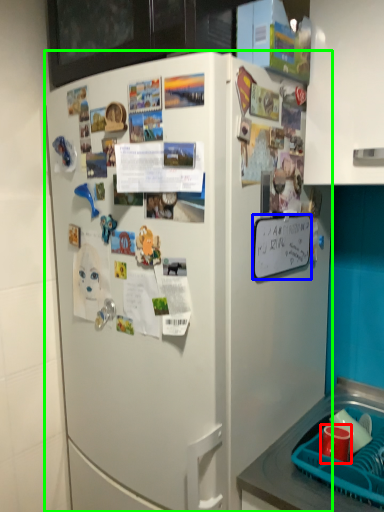
Question: Based on their relative distances, which object is farther from coffee cup (highlighted by a red box)? Choose from poster (highlighted by a blue box) and refrigerator (highlighted by a green box).

Choices:
 (A) poster
 (B) refrigerator

Answer: (B)